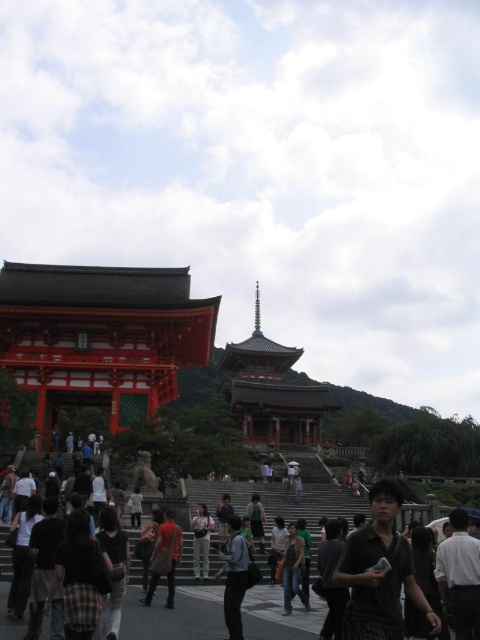
Is point (302, 396) positioned before point (168, 561)?

That is False.

Between point (297, 348) and point (149, 604), which one is positioned in front?

Positioned in front is point (149, 604).

Locate an element on the screen. shiny red pagoda at center is located at coordinates (271, 390).

Which is more to the right, plaid fabric shirt at lower left or dark gray fabric backpack at center?

dark gray fabric backpack at center

Can you confirm if plaid fabric shirt at lower left is wider than dark gray fabric backpack at center?

Indeed, plaid fabric shirt at lower left has a greater width compared to dark gray fabric backpack at center.

Is point (108, 579) in front of point (225, 518)?

Yes, it is.

Image resolution: width=480 pixels, height=640 pixels. In order to click on plaid fabric shirt at lower left in this screenshot , I will do `click(80, 577)`.

Who is lower down, green fabric backpack at center or dark gray fabric backpack at center?

green fabric backpack at center is lower down.

Does green fabric backpack at center appear on the right side of dark gray fabric backpack at center?

Yes, green fabric backpack at center is to the right of dark gray fabric backpack at center.

This screenshot has width=480, height=640. I want to click on green fabric backpack at center, so (256, 520).